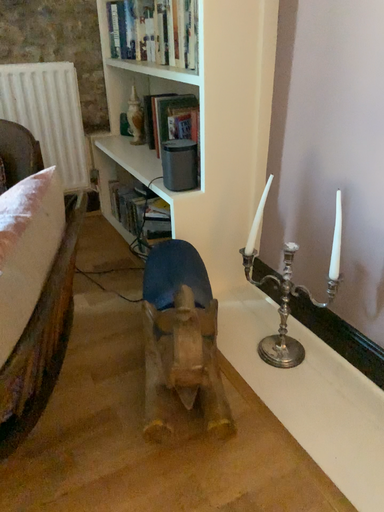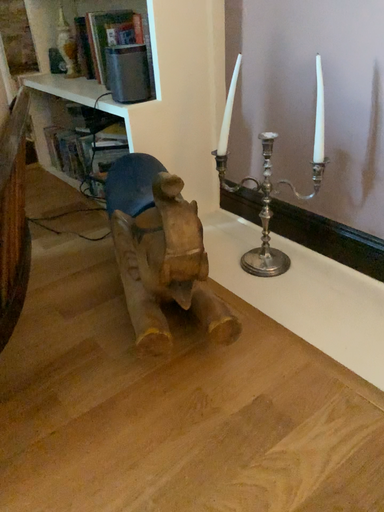
Question: How did the camera likely rotate when shooting the video?

Choices:
 (A) rotated left
 (B) rotated right

Answer: (B)